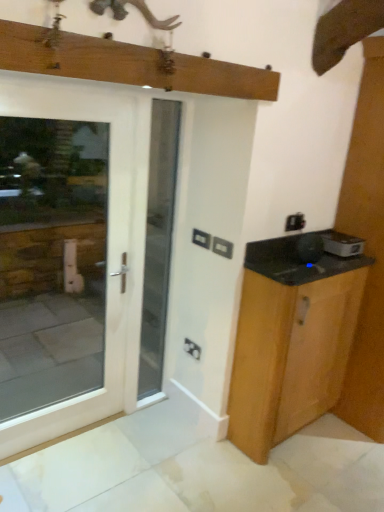
Question: From a real-world perspective, is white wood door at left positioned above or below wooden cabinet at right?

Choices:
 (A) above
 (B) below

Answer: (A)

Question: Is white wood door at left inside or outside of wooden cabinet at right?

Choices:
 (A) inside
 (B) outside

Answer: (B)

Question: Estimate the real-world distances between objects in this image. Which object is farther from the white plastic electric outlet at center, which is counted as the second electric outlet, starting from the front?

Choices:
 (A) white wood door at left
 (B) wooden cabinet at right
 (C) white glossy microwave at right
 (D) matte black electric outlet at center, which appears as the third electric outlet when viewed from the top
 (E) black plastic electric outlet at center, positioned as the first electric outlet in front-to-back order

Answer: (A)

Question: Which is nearer to the white wood door at left?

Choices:
 (A) black plastic electric outlet at center, positioned as the first electric outlet in front-to-back order
 (B) white plastic electric outlet at center, the first electric outlet when ordered from top to bottom
 (C) white glossy microwave at right
 (D) matte black electric outlet at center, which appears as the third electric outlet when viewed from the top
 (E) wooden beam at upper center

Answer: (D)